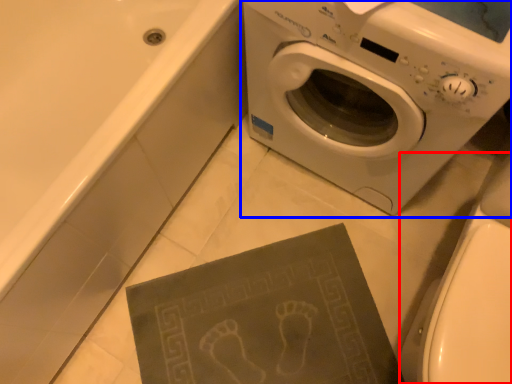
Question: Which object appears closest to the camera in this image, toilet bowl (highlighted by a red box) or washing machine (highlighted by a blue box)?

Choices:
 (A) toilet bowl
 (B) washing machine

Answer: (A)